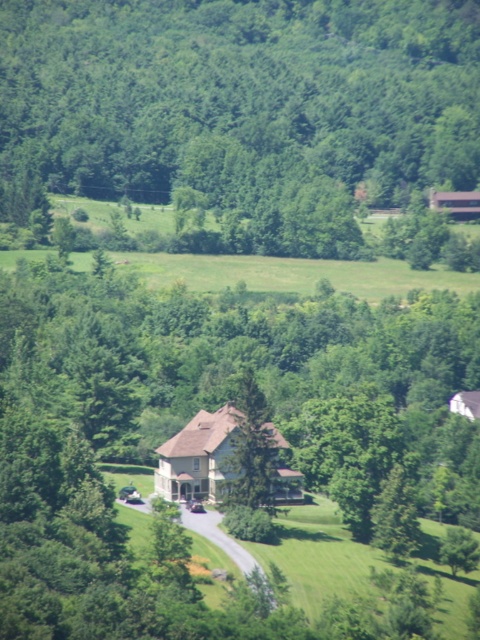
You are a landscape architect designing a walking path that needs to pass between the green leafy tree at upper center and the green textured tree at center. Considering their sizes, which tree will require more clearance space in the path design?

The green leafy tree at upper center requires more clearance space because it is bigger than the green textured tree at center.

You are standing at the point marked by the coordinate point at point (244, 104). What object is located at that exact coordinate?

The green leafy tree at upper center is located at point (244, 104).